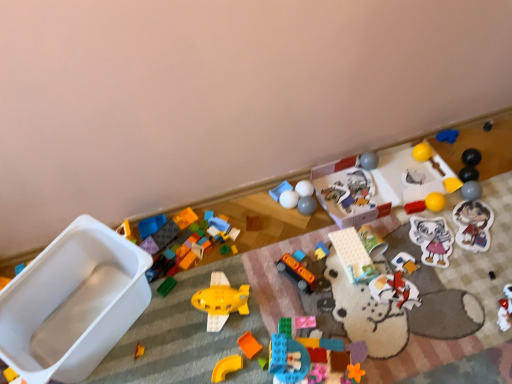
Identify the location of vacant area that lies between yellow plastic airplane at center, the 22th toy in the right-to-left sequence, and translucent plastic blocks at center, arranged as the 11th toy when viewed from the left. (259, 334).